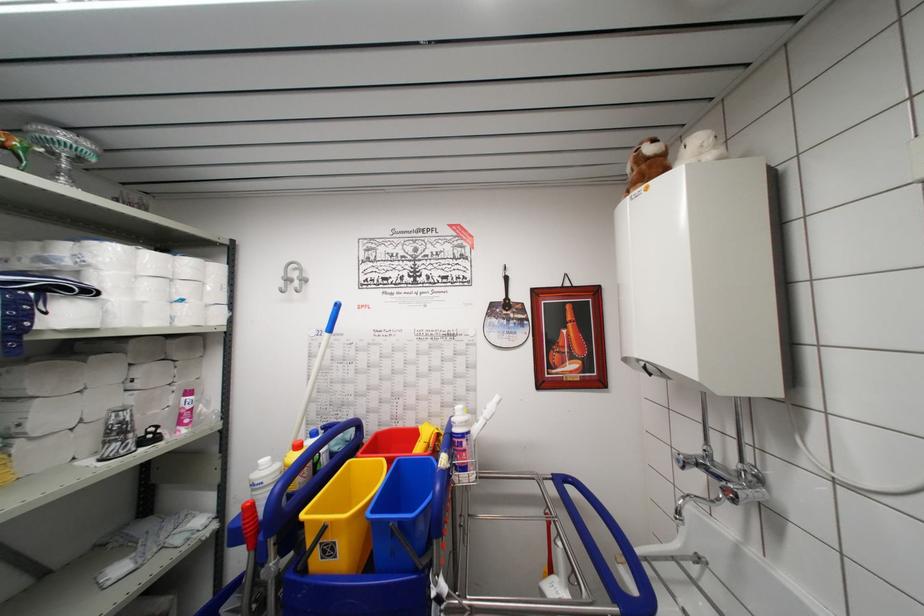
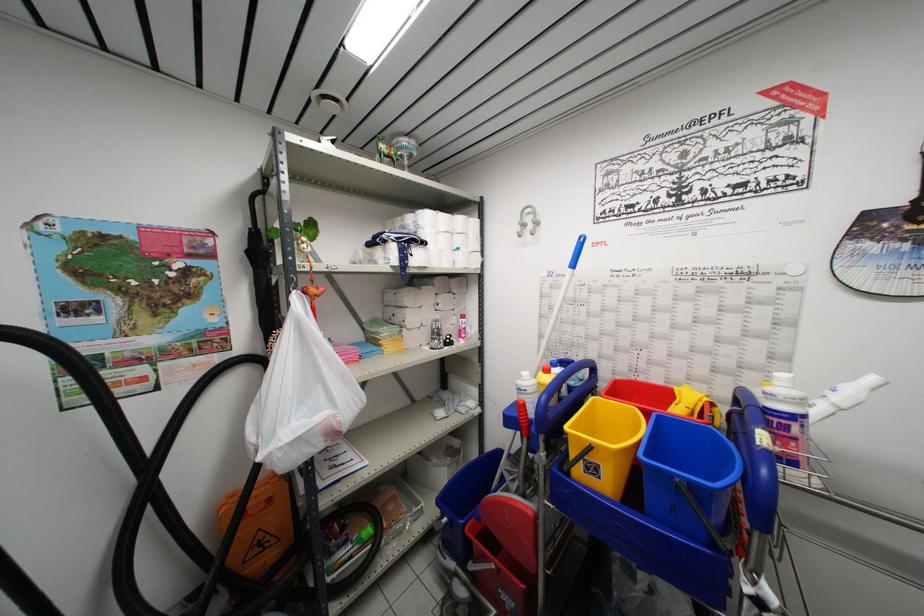
Where in the second image is the point corresponding to point 251,528 from the first image?

(526, 421)